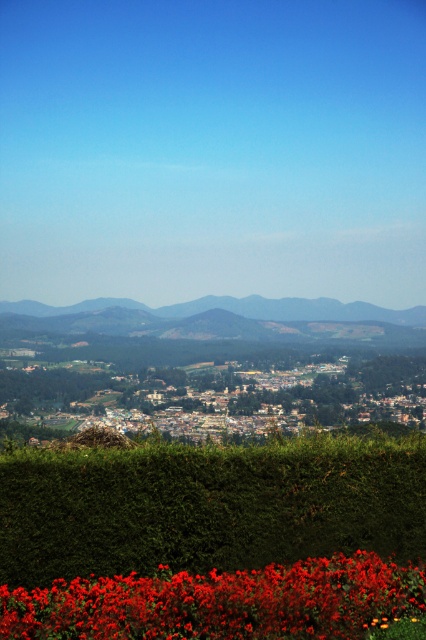
You are an urban planner analyzing the landscape. You need to determine if the green leafy hedge at lower center can be expanded to match the width of the gray textured mountain at center. Based on the current widths, would this expansion be feasible?

The green leafy hedge at lower center is currently narrower than the gray textured mountain at center. To match the mountain, the hedge would need to be expanded beyond its current width, which may require additional space and resources.

You are standing at the center of the image and want to walk towards the green leafy hedge at lower center. Which direction should you move in to reach it?

The green leafy hedge at lower center is located at point 0.792 on the x axis and 0.488 on the y axis. Since you are at the center of the image, you should move towards the lower right direction to reach it.